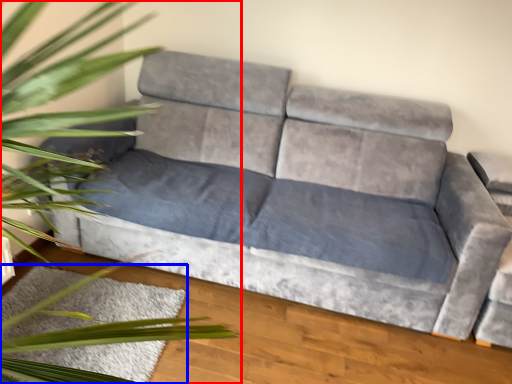
Question: Which point is closer to the camera, houseplant (highlighted by a red box) or mat (highlighted by a blue box)?

Choices:
 (A) houseplant
 (B) mat

Answer: (A)